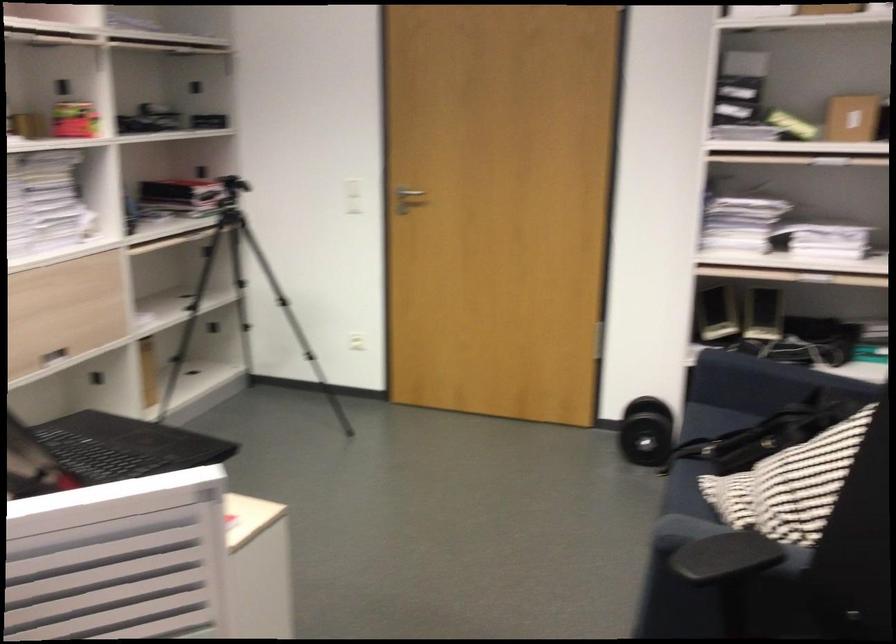
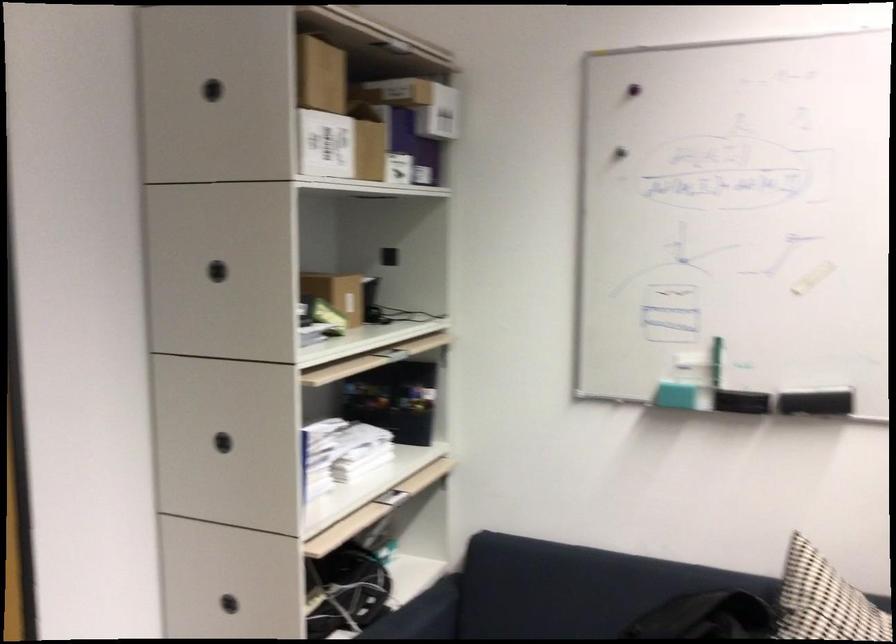
Find the pixel in the second image that matches point (702, 299) in the first image.

(228, 603)